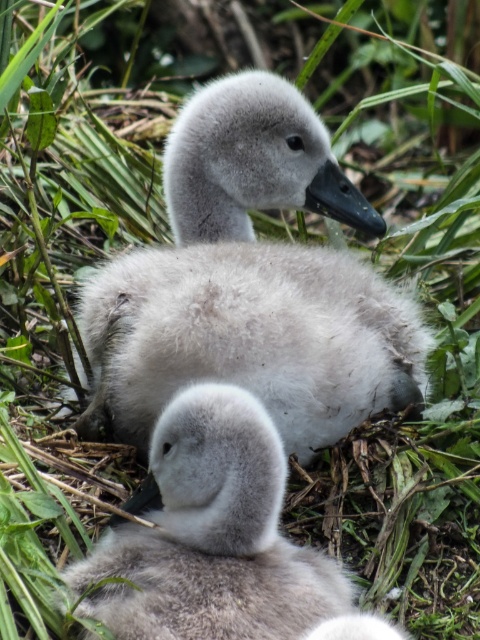
You are a wildlife photographer observing two swans in their natural habitat. You notice the fluffy gray swan at upper center and the soft gray down at center. Which of these two is bigger?

The fluffy gray swan at upper center is larger in size than the soft gray down at center.

Consider the image. You are standing in a marshland and see the fluffy gray swan at upper center. If you want to approach it without disturbing it, what is the minimum distance you should maintain?

The minimum distance you should maintain is 1.13 meters to avoid disturbing the fluffy gray swan at upper center.